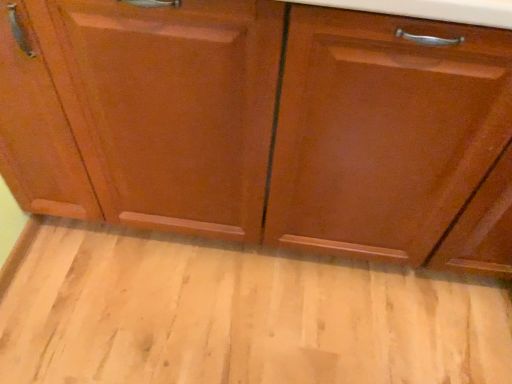
Question: Does point (270, 268) appear closer or farther from the camera than point (438, 18)?

Choices:
 (A) closer
 (B) farther

Answer: (B)

Question: Relative to glossy wood drawer at right, is matte wood floor at lower center in front or behind?

Choices:
 (A) behind
 (B) front

Answer: (A)

Question: From a real-world perspective, is matte wood floor at lower center positioned above or below glossy wood drawer at right?

Choices:
 (A) below
 (B) above

Answer: (A)

Question: Looking at their shapes, would you say glossy wood drawer at right is wider or thinner than matte wood floor at lower center?

Choices:
 (A) wide
 (B) thin

Answer: (B)

Question: From a real-world perspective, is glossy wood drawer at right positioned above or below matte wood floor at lower center?

Choices:
 (A) below
 (B) above

Answer: (B)

Question: From the image's perspective, is glossy wood drawer at right located above or below matte wood floor at lower center?

Choices:
 (A) below
 (B) above

Answer: (B)

Question: Is glossy wood drawer at right situated inside matte wood floor at lower center or outside?

Choices:
 (A) outside
 (B) inside

Answer: (A)